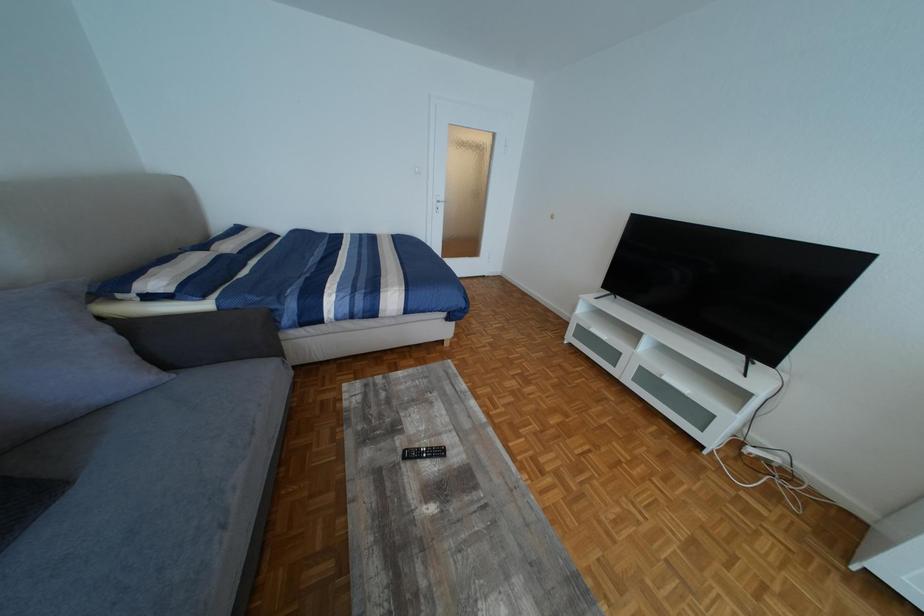
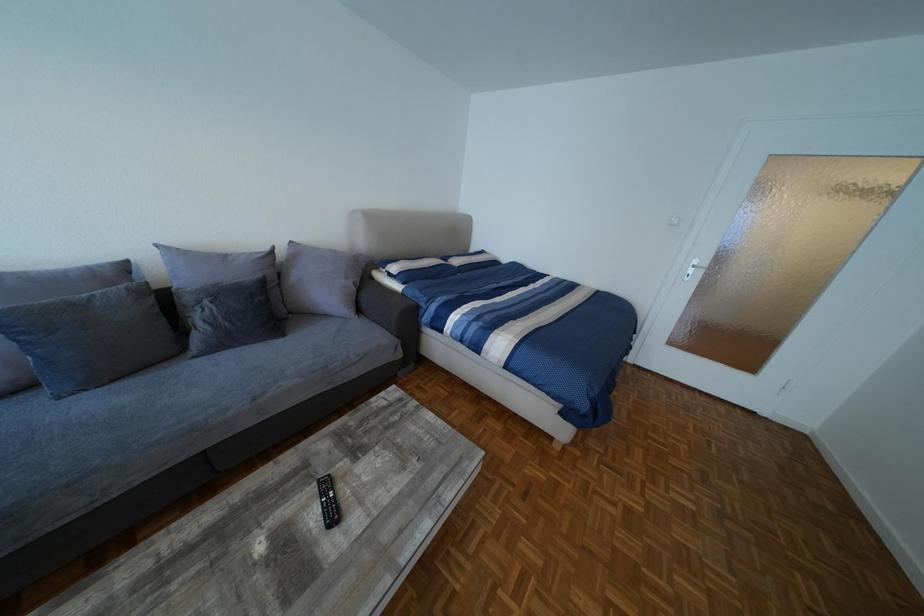
Question: The camera is either moving clockwise (left) or counter-clockwise (right) around the object. The first image is from the beginning of the video and the second image is from the end. Is the camera moving left or right when shooting the video?

Choices:
 (A) Left
 (B) Right

Answer: (B)